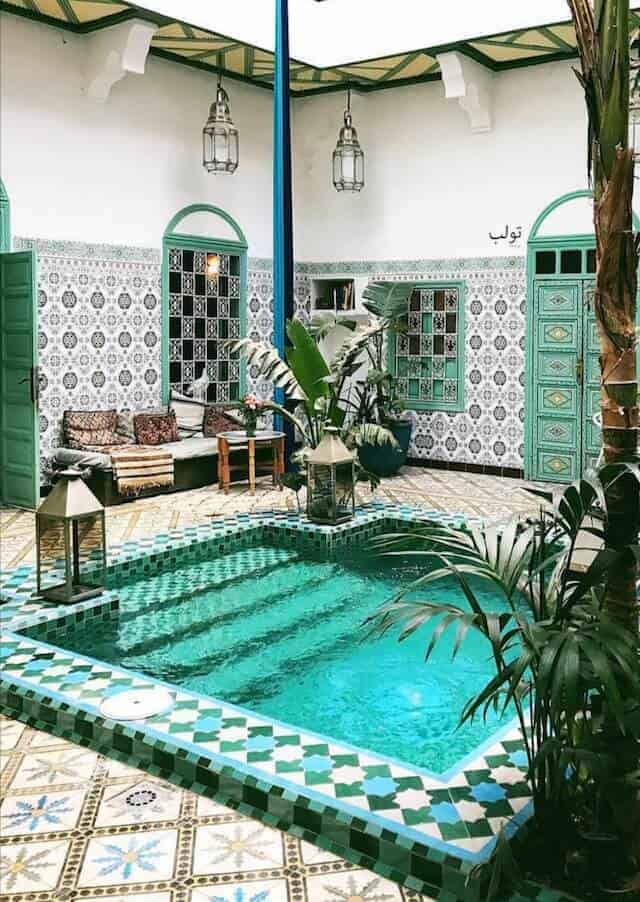
Locate an element on the screen. Image resolution: width=640 pixels, height=902 pixels. bench is located at coordinates (193, 446).